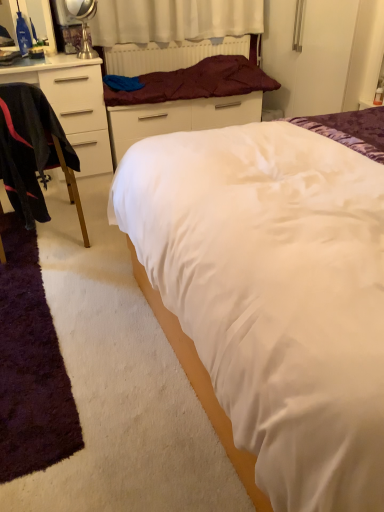
Question: From the image's perspective, does white glossy bed frame at upper center appear lower than maroon fabric radiator at upper center?

Choices:
 (A) yes
 (B) no

Answer: (A)

Question: Considering the relative sizes of white glossy bed frame at upper center and maroon fabric radiator at upper center in the image provided, is white glossy bed frame at upper center wider than maroon fabric radiator at upper center?

Choices:
 (A) yes
 (B) no

Answer: (A)

Question: From a real-world perspective, is white glossy bed frame at upper center on top of maroon fabric radiator at upper center?

Choices:
 (A) yes
 (B) no

Answer: (B)

Question: Can you confirm if white glossy bed frame at upper center is shorter than maroon fabric radiator at upper center?

Choices:
 (A) yes
 (B) no

Answer: (B)

Question: Does white glossy bed frame at upper center come in front of maroon fabric radiator at upper center?

Choices:
 (A) no
 (B) yes

Answer: (B)

Question: Considering their positions, is burgundy fabric blanket at upper center located in front of or behind white glossy bed frame at upper center?

Choices:
 (A) front
 (B) behind

Answer: (A)

Question: Looking at their shapes, would you say burgundy fabric blanket at upper center is wider or thinner than white glossy bed frame at upper center?

Choices:
 (A) thin
 (B) wide

Answer: (A)

Question: Do you think burgundy fabric blanket at upper center is within white glossy bed frame at upper center, or outside of it?

Choices:
 (A) outside
 (B) inside

Answer: (A)

Question: Is point (248, 90) closer or farther from the camera than point (175, 109)?

Choices:
 (A) farther
 (B) closer

Answer: (A)

Question: From the image's perspective, is white glossy bed frame at upper center positioned above or below burgundy fabric blanket at upper center?

Choices:
 (A) below
 (B) above

Answer: (A)

Question: In terms of height, does white glossy bed frame at upper center look taller or shorter compared to burgundy fabric blanket at upper center?

Choices:
 (A) tall
 (B) short

Answer: (A)

Question: In terms of width, does white glossy bed frame at upper center look wider or thinner when compared to burgundy fabric blanket at upper center?

Choices:
 (A) thin
 (B) wide

Answer: (B)

Question: Based on their sizes in the image, would you say white glossy bed frame at upper center is bigger or smaller than burgundy fabric blanket at upper center?

Choices:
 (A) big
 (B) small

Answer: (A)

Question: Looking at the image, does purple shaggy rug at lower left seem bigger or smaller compared to white satin bed at center?

Choices:
 (A) big
 (B) small

Answer: (B)

Question: Which is correct: purple shaggy rug at lower left is inside white satin bed at center, or outside of it?

Choices:
 (A) inside
 (B) outside

Answer: (B)